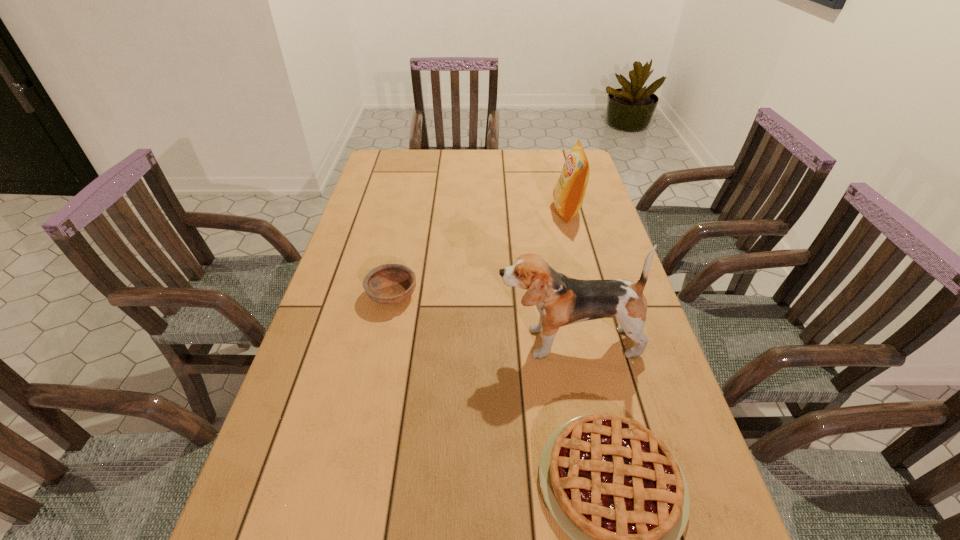
This screenshot has height=540, width=960. In order to click on puppy in this screenshot , I will do `click(561, 300)`.

Where is `the tallest object`? the tallest object is located at coordinates (561, 300).

I want to click on the farthest object, so click(x=568, y=195).

Locate an element on the screen. the second tallest object is located at coordinates (568, 195).

Where is `bowl`? This screenshot has width=960, height=540. bowl is located at coordinates (389, 284).

This screenshot has width=960, height=540. In order to click on the leftmost object in this screenshot , I will do pos(389,284).

At what (x,y) coordinates should I click in order to perform the action: click on free spot located 0.270m at the face of the puppy. Please return your answer as a coordinate pair (x, y). Looking at the image, I should click on (386, 342).

This screenshot has width=960, height=540. What are the coordinates of `vacant space located 0.290m at the face of the puppy` in the screenshot? It's located at [377, 342].

The width and height of the screenshot is (960, 540). In order to click on vacant space situated at the face of the puppy in this screenshot , I will do `click(444, 342)`.

In order to click on blank area located 0.060m on the front-facing side of the crisp (potato chip) in this screenshot , I will do `click(536, 211)`.